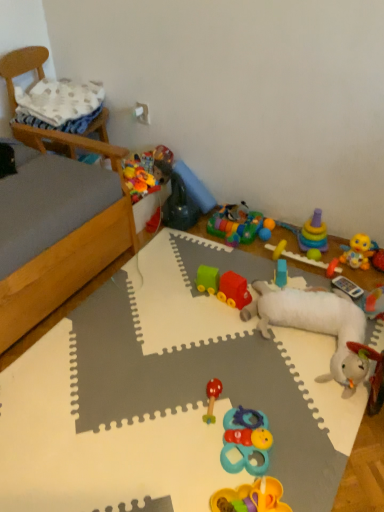
Image resolution: width=384 pixels, height=512 pixels. What are the coordinates of `free region on the left part of green rubber ball at upper right, the fourth toy from the top` in the screenshot? It's located at (272, 262).